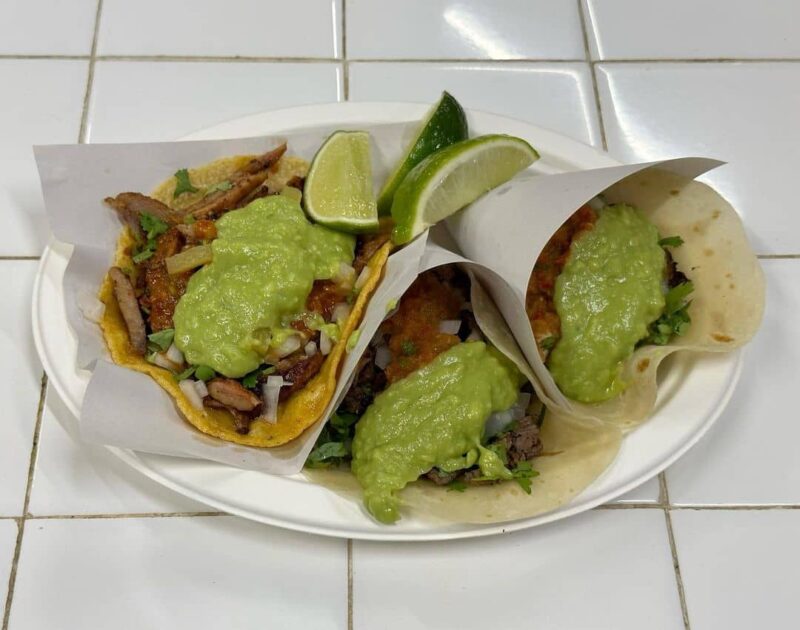
The image size is (800, 630). I want to click on grout, so click(678, 566).